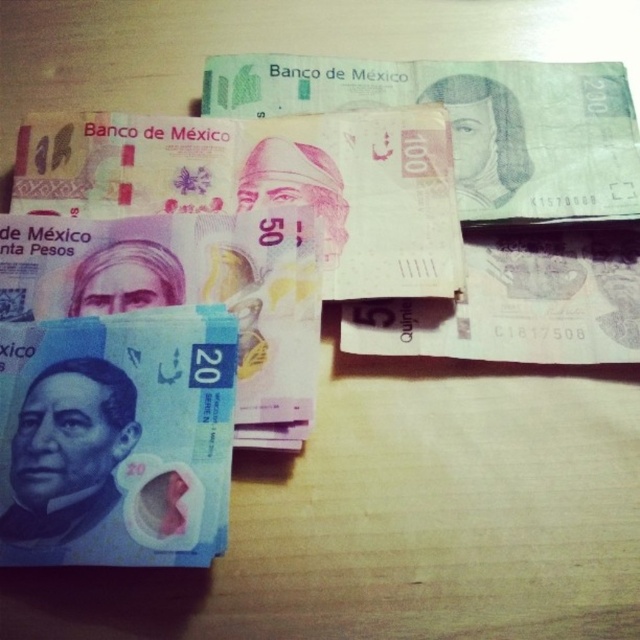
In order to click on blue paper currency at lower left in this screenshot , I will do `click(115, 440)`.

Is point (81, 385) farther from viewer compared to point (316, 273)?

No, (81, 385) is closer to viewer.

The height and width of the screenshot is (640, 640). I want to click on blue paper currency at lower left, so click(x=115, y=440).